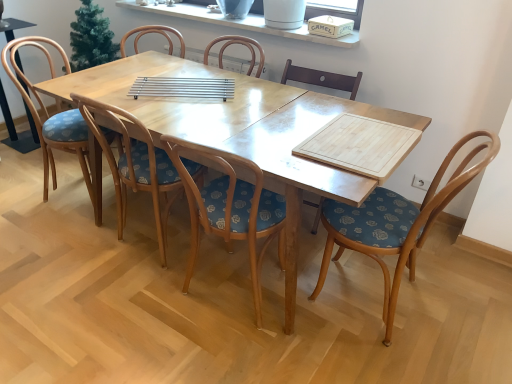
Locate an element on the screen. This screenshot has height=384, width=512. free location in front of woodenwoodenchair at right, which is counted as the fifth chair, starting from the left is located at coordinates (382, 359).